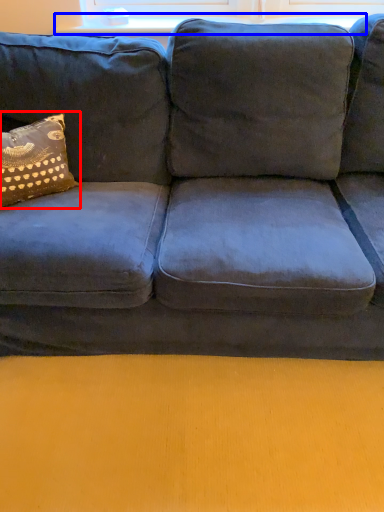
Question: Which point is closer to the camera, pillow (highlighted by a red box) or window sill (highlighted by a blue box)?

Choices:
 (A) pillow
 (B) window sill

Answer: (A)